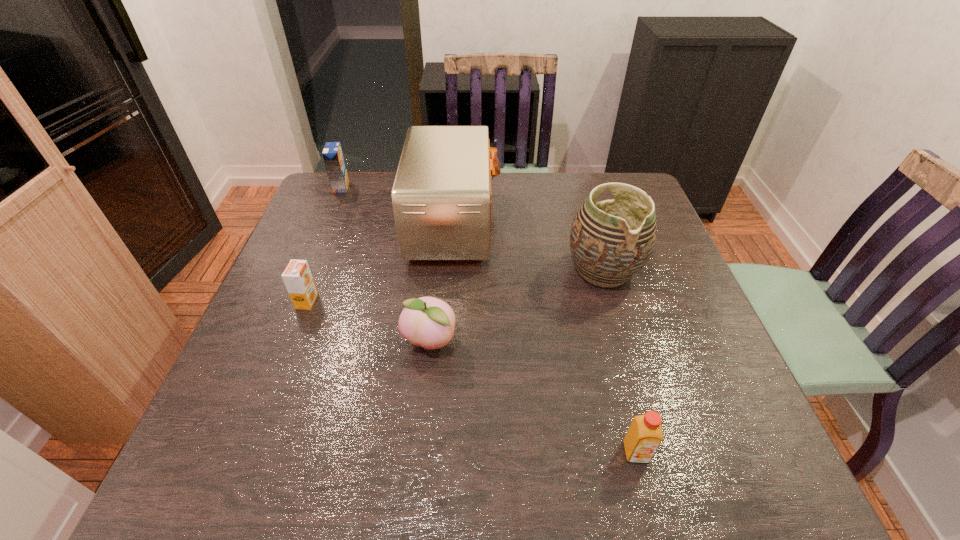
Find the location of `blank space at the far left corner`. blank space at the far left corner is located at coordinates (328, 195).

Locate an element on the screen. free space at the near right corner is located at coordinates (699, 484).

The image size is (960, 540). Identify the location of unoccupied position between the second nearest orange juice and the pottery. point(455,286).

Locate an element on the screen. The image size is (960, 540). vacant space in between the farthest orange juice and the peach is located at coordinates (385, 265).

What are the coordinates of `empty location between the second nearest orange juice and the peach` in the screenshot? It's located at (369, 322).

Where is `vacant point located between the pottery and the toaster oven`? vacant point located between the pottery and the toaster oven is located at coordinates (529, 248).

Find the location of a particular element. The width and height of the screenshot is (960, 540). free area in between the rightmost orange juice and the pottery is located at coordinates (619, 361).

You are a GUI agent. You are given a task and a screenshot of the screen. Output one action in this format:
    pyautogui.click(x=<x>, y=<y>)
    Task: Click on the free area in between the farthest orange juice and the nearest object
    
    Given the screenshot: What is the action you would take?
    pyautogui.click(x=489, y=320)

Locate an element on the screen. This screenshot has width=960, height=540. vacant region between the second farthest orange juice and the pottery is located at coordinates (455, 286).

At what (x,y) coordinates should I click in order to perform the action: click on vacant space that's between the nearest orange juice and the pottery. Please return your answer as a coordinate pair (x, y). Looking at the image, I should click on [619, 361].